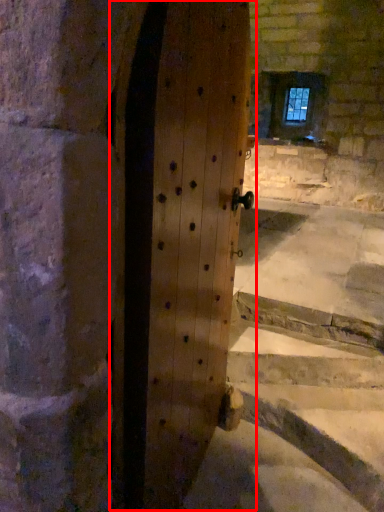
Question: Observing the image, what is the correct spatial positioning of door (annotated by the red box) in reference to window?

Choices:
 (A) right
 (B) left

Answer: (B)